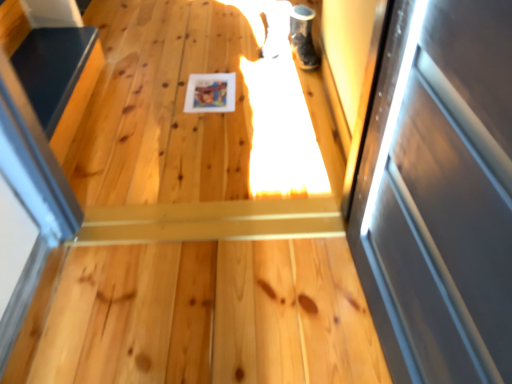
Identify the location of vacant space in shiny black shoe at upper right (from a real-world perspective). (304, 61).